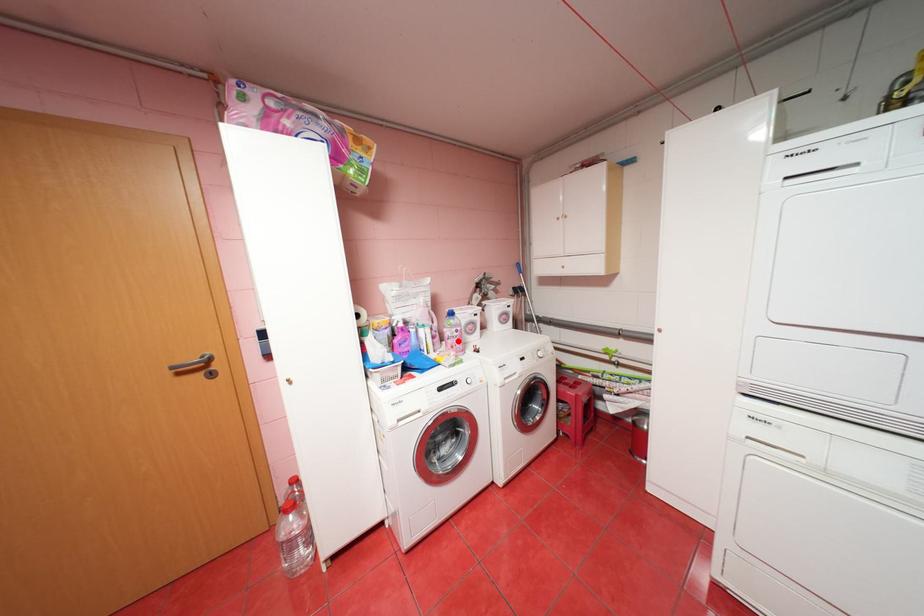
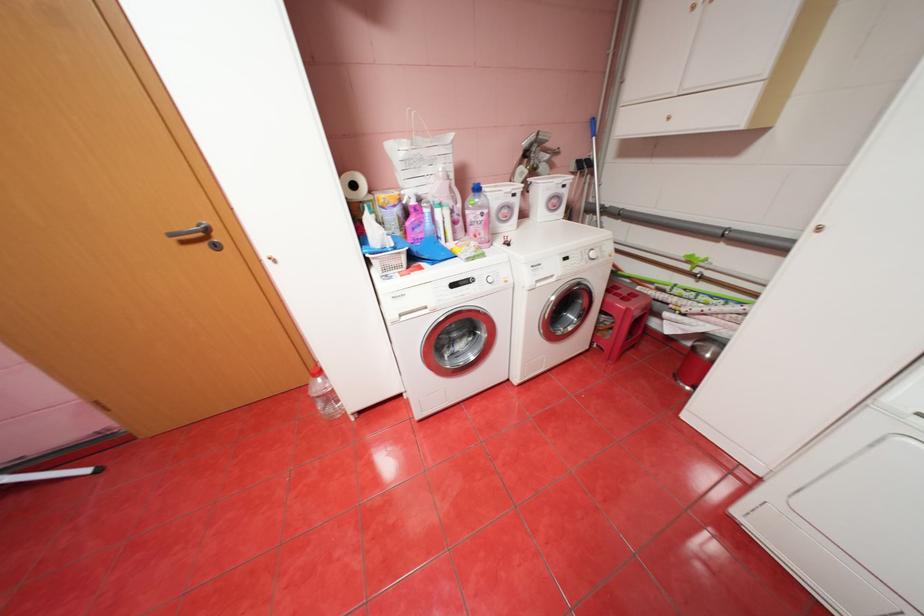
Where in the second image is the point corresponding to the highlighted location from the first image?

(480, 228)